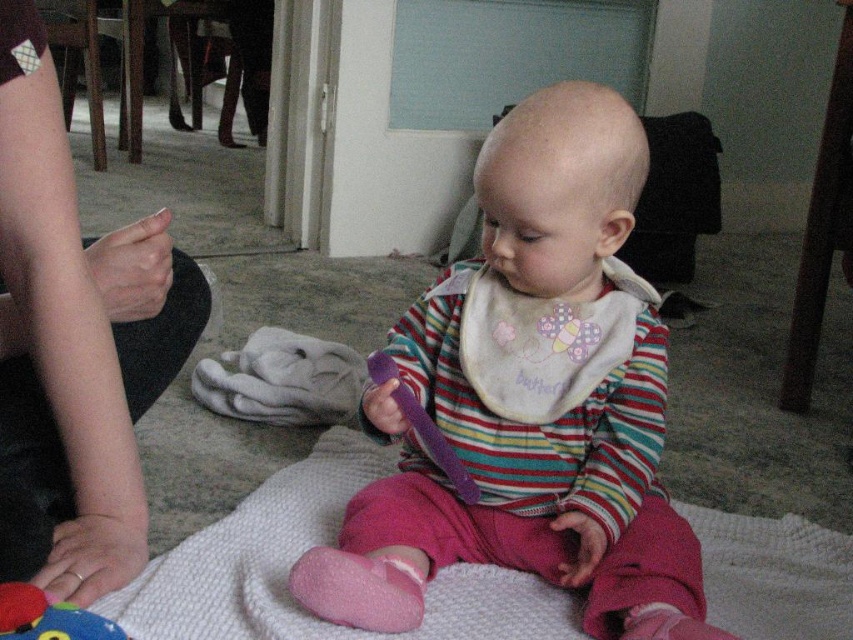
Question: Which point appears closest to the camera in this image?

Choices:
 (A) (28, 605)
 (B) (67, 570)
 (C) (584, 394)
 (D) (126, 321)

Answer: (A)

Question: Is matte purple spoon at center above smooth skin arm at lower left?

Choices:
 (A) yes
 (B) no

Answer: (B)

Question: Which of the following is the farthest from the observer?

Choices:
 (A) matte purple spoon at center
 (B) white textured blanket at center
 (C) rubber teething ring at lower left
 (D) smooth skin arm at lower left

Answer: (C)

Question: Can you confirm if matte purple spoon at center is smaller than soft plush toy at lower left?

Choices:
 (A) yes
 (B) no

Answer: (B)

Question: From the image, what is the correct spatial relationship of white textured blanket at center in relation to soft plush toy at lower left?

Choices:
 (A) above
 (B) below

Answer: (B)

Question: Which point appears closest to the camera in this image?

Choices:
 (A) (225, 634)
 (B) (68, 570)
 (C) (161, 387)

Answer: (A)